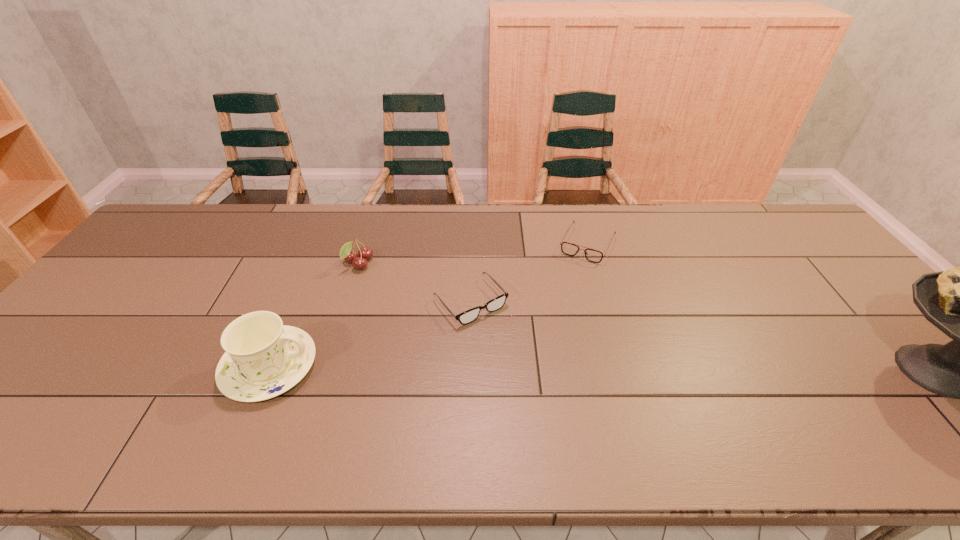
Locate an element on the screen. The width and height of the screenshot is (960, 540). free region located on the front-facing side of the spectacles is located at coordinates (560, 403).

At what (x,y) coordinates should I click in order to perform the action: click on free space located on the front-facing side of the fourth object from left to right. Please return your answer as a coordinate pair (x, y). This screenshot has width=960, height=540. Looking at the image, I should click on tap(564, 294).

The image size is (960, 540). Identify the location of free space located 0.210m on the front-facing side of the fourth object from left to right. (557, 307).

Find the location of `blank space located 0.280m on the front-facing side of the fourth object from left to right`. blank space located 0.280m on the front-facing side of the fourth object from left to right is located at coordinates (548, 325).

Where is `object positioned at the far edge`? The image size is (960, 540). object positioned at the far edge is located at coordinates (595, 256).

Where is `object that is at the near edge`? object that is at the near edge is located at coordinates (264, 358).

Identify the location of vacant space at the far edge of the desktop. (321, 218).

Find the location of `vacant space at the near edge`. vacant space at the near edge is located at coordinates (247, 413).

The width and height of the screenshot is (960, 540). Identify the location of vacant space at the left edge of the desktop. (108, 295).

Where is `free region at the right edge`? The image size is (960, 540). free region at the right edge is located at coordinates (791, 252).